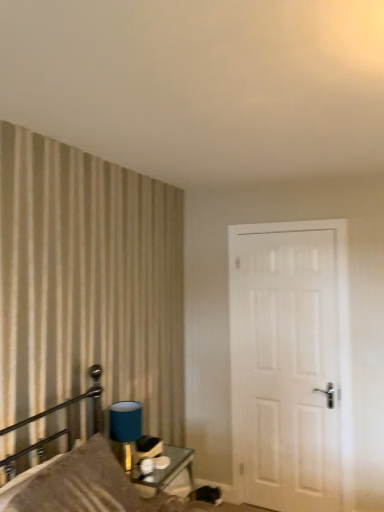
Question: Visually, is white matte door at right positioned to the left or to the right of blue fabric lampshade at upper left?

Choices:
 (A) right
 (B) left

Answer: (A)

Question: Is white matte door at right wider or thinner than blue fabric lampshade at upper left?

Choices:
 (A) wide
 (B) thin

Answer: (B)

Question: Estimate the real-world distances between objects in this image. Which object is closer to the metallic glass table at lower center?

Choices:
 (A) textured beige pillow at left
 (B) white matte door at right
 (C) satin brown pillow at left
 (D) blue fabric lampshade at upper left

Answer: (D)

Question: Which object is positioned closest to the white matte door at right?

Choices:
 (A) blue fabric lampshade at upper left
 (B) textured beige pillow at left
 (C) satin brown pillow at left
 (D) metallic glass table at lower center

Answer: (D)